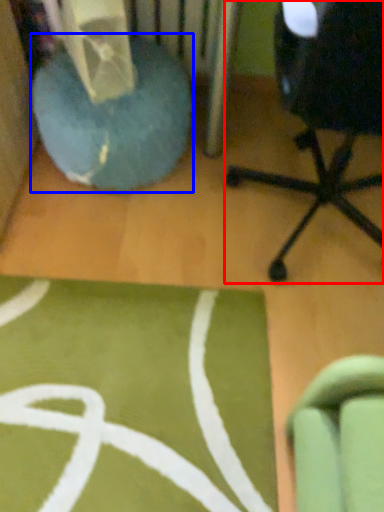
Question: Which object is further to the camera taking this photo, chair (highlighted by a red box) or bean bag chair (highlighted by a blue box)?

Choices:
 (A) chair
 (B) bean bag chair

Answer: (B)